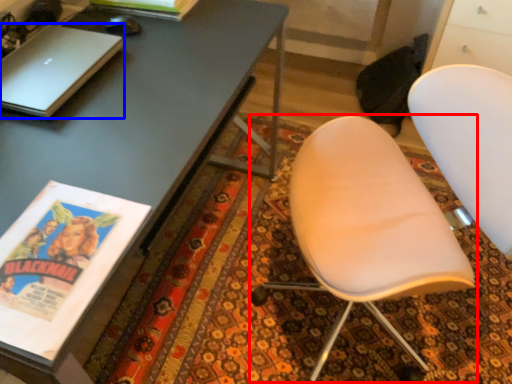
Question: Which object is further to the camera taking this photo, chair (highlighted by a red box) or laptop (highlighted by a blue box)?

Choices:
 (A) chair
 (B) laptop

Answer: (B)